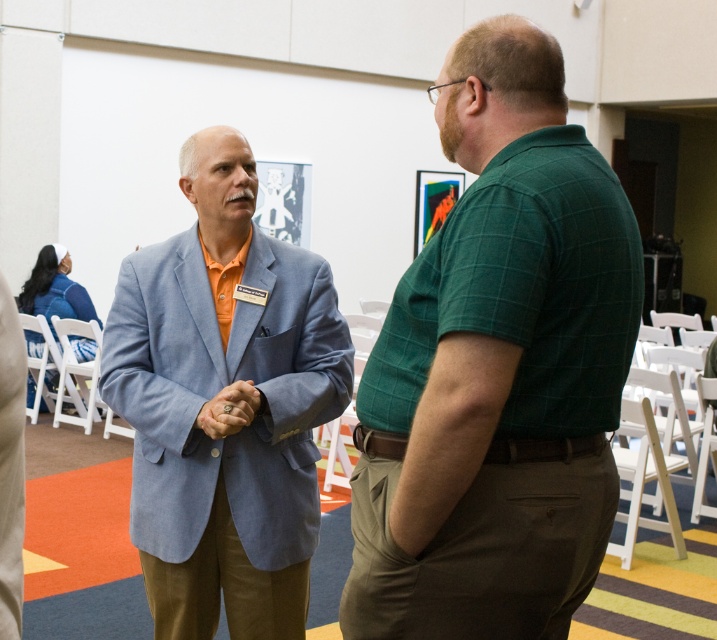
Which is in front, point (607, 419) or point (244, 406)?

Point (607, 419)

Is green checkered shirt at right wider than matte gold ring at center?

Yes.

What do you see at coordinates (498, 369) in the screenshot? This screenshot has height=640, width=717. I see `green checkered shirt at right` at bounding box center [498, 369].

Identify the location of green checkered shirt at right. (498, 369).

Which is more to the right, light blue fabric blazer at center or matte gold ring at center?

matte gold ring at center is more to the right.

Who is positioned more to the left, light blue fabric blazer at center or matte gold ring at center?

From the viewer's perspective, light blue fabric blazer at center appears more on the left side.

You are a GUI agent. You are given a task and a screenshot of the screen. Output one action in this format:
    pyautogui.click(x=<x>, y=<y>)
    Task: Click on the light blue fabric blazer at center
    
    Given the screenshot: What is the action you would take?
    pyautogui.click(x=214, y=394)

Is green checkered shirt at right thinner than light blue fabric blazer at center?

Yes.

Between point (571, 396) and point (148, 595), which one is positioned behind?

Positioned behind is point (148, 595).

The width and height of the screenshot is (717, 640). What are the coordinates of `green checkered shirt at right` in the screenshot? It's located at (498, 369).